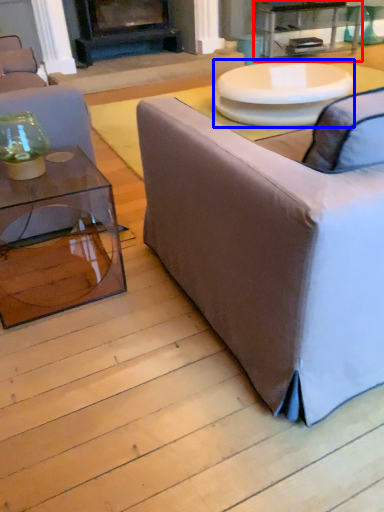
Question: Which object is closer to the camera taking this photo, table (highlighted by a red box) or round table (highlighted by a blue box)?

Choices:
 (A) table
 (B) round table

Answer: (B)